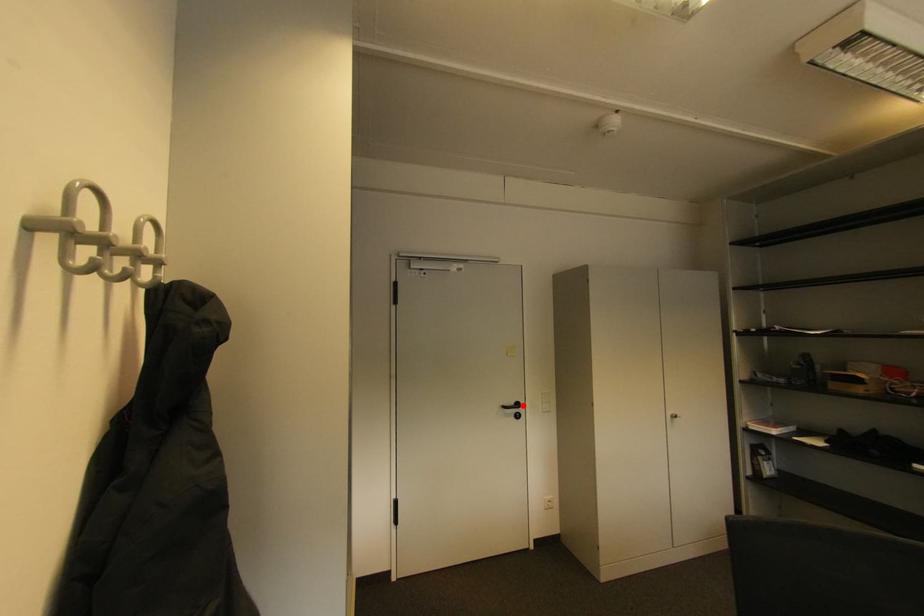
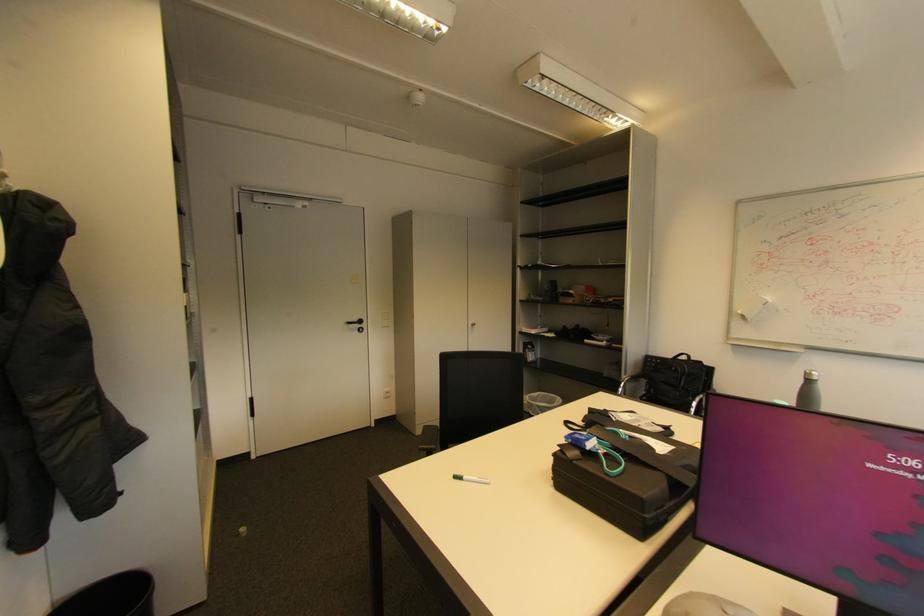
Where in the second image is the point corresponding to the highlighted location from the first image?

(366, 322)